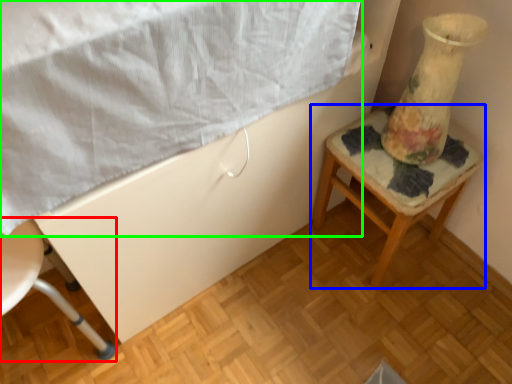
Question: Which is farther away from chair (highlighted by a red box)? furniture (highlighted by a blue box) or sheet (highlighted by a green box)?

Choices:
 (A) furniture
 (B) sheet

Answer: (A)